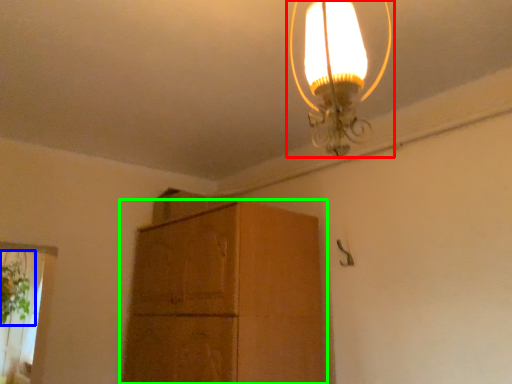
Question: Which object is the farthest from lamp (highlighted by a red box)? Choose among these: plant (highlighted by a blue box) or cabinetry (highlighted by a green box).

Choices:
 (A) plant
 (B) cabinetry

Answer: (A)